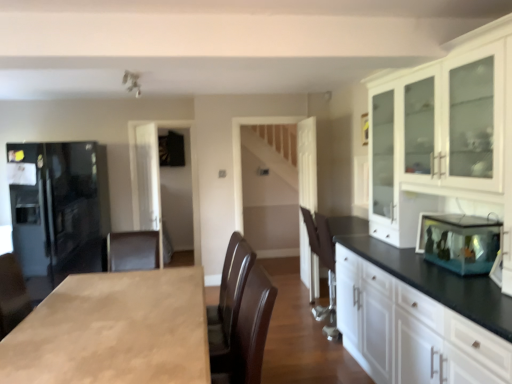
Question: Could you tell me if transparent glass fish tank at right is facing brown leather armchair at center?

Choices:
 (A) no
 (B) yes

Answer: (A)

Question: Is transparent glass fish tank at right further to camera compared to brown leather armchair at center?

Choices:
 (A) no
 (B) yes

Answer: (A)

Question: Is transparent glass fish tank at right to the right of brown leather armchair at center from the viewer's perspective?

Choices:
 (A) yes
 (B) no

Answer: (A)

Question: From a real-world perspective, does transparent glass fish tank at right stand above brown leather armchair at center?

Choices:
 (A) yes
 (B) no

Answer: (A)

Question: Would you consider transparent glass fish tank at right to be distant from brown leather armchair at center?

Choices:
 (A) yes
 (B) no

Answer: (A)

Question: Is brown leather armchair at center at the back of transparent glass fish tank at right?

Choices:
 (A) no
 (B) yes

Answer: (A)

Question: Is brown leather armchair at center not inside transparent glass cabinet at center?

Choices:
 (A) yes
 (B) no

Answer: (A)

Question: Is brown leather armchair at center at the right side of transparent glass cabinet at center?

Choices:
 (A) no
 (B) yes

Answer: (B)

Question: Does brown leather armchair at center come in front of transparent glass cabinet at center?

Choices:
 (A) no
 (B) yes

Answer: (B)

Question: Can you confirm if brown leather armchair at center is wider than transparent glass cabinet at center?

Choices:
 (A) yes
 (B) no

Answer: (A)

Question: Can you confirm if brown leather armchair at center is bigger than transparent glass cabinet at center?

Choices:
 (A) yes
 (B) no

Answer: (A)

Question: From a real-world perspective, is brown leather armchair at center beneath transparent glass cabinet at center?

Choices:
 (A) no
 (B) yes

Answer: (B)

Question: Considering the relative sizes of light brown wood countertop at center and transparent glass fish tank at right in the image provided, is light brown wood countertop at center bigger than transparent glass fish tank at right?

Choices:
 (A) yes
 (B) no

Answer: (A)